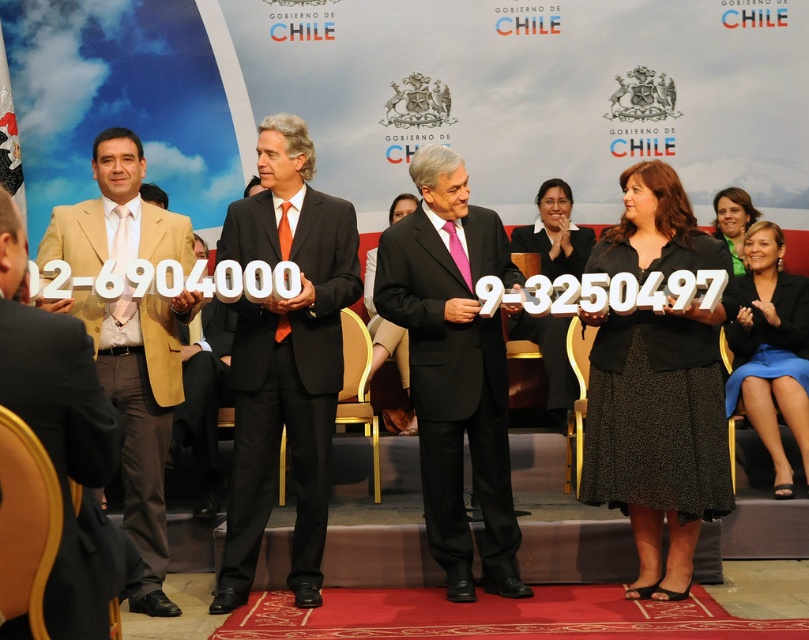
You are attending the formal event under the banner of Gobierno de Chile. You notice a point marked at coordinates (454, 368). Based on the scene description, where is this point located?

The point (454, 368) is located on the black matte suit at center.

Consider the image. You are attending a formal event at the Government of Chile. You notice two people on stage wearing a matte black suit at center and a black dress at center. Which one is positioned to the left?

The matte black suit at center is positioned to the left of the black dress at center.

You are attending a virtual event and need to focus on the blue fabric skirt at lower right and the matte black dress at center. Which one appears nearer to you in the image?

The blue fabric skirt at lower right is closer to the viewer than the matte black dress at center.